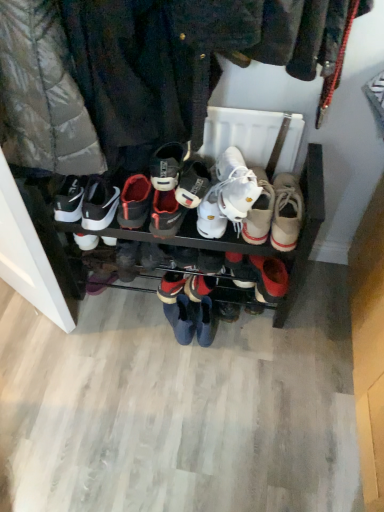
Question: Is white leather sneakers at center, which is counted as the sixth footwear, starting from the left, touching blue suede boots at center, the fourth footwear viewed from the left?

Choices:
 (A) yes
 (B) no

Answer: (B)

Question: Can blue suede boots at center, marked as the 5th footwear in a right-to-left arrangement, be found inside white leather sneakers at center, which is counted as the sixth footwear, starting from the left?

Choices:
 (A) yes
 (B) no

Answer: (B)

Question: From the image's perspective, is white leather sneakers at center, which is counted as the sixth footwear, starting from the left, above blue suede boots at center, the fourth footwear viewed from the left?

Choices:
 (A) yes
 (B) no

Answer: (A)

Question: Is white leather sneakers at center, which is counted as the sixth footwear, starting from the left, thinner than blue suede boots at center, the fourth footwear viewed from the left?

Choices:
 (A) yes
 (B) no

Answer: (B)

Question: Is white leather sneakers at center, which is counted as the sixth footwear, starting from the left, positioned with its back to blue suede boots at center, marked as the 5th footwear in a right-to-left arrangement?

Choices:
 (A) no
 (B) yes

Answer: (A)

Question: Is white leather sneaker at center, which is the second footwear from left to right, bigger or smaller than white leather sneakers at center, positioned as the 5th footwear in left-to-right order?

Choices:
 (A) big
 (B) small

Answer: (B)

Question: Considering the positions of white leather sneaker at center, which is the second footwear from left to right, and white leather sneakers at center, which is the 4th footwear from right to left, in the image, is white leather sneaker at center, which is the second footwear from left to right, wider or thinner than white leather sneakers at center, which is the 4th footwear from right to left,?

Choices:
 (A) thin
 (B) wide

Answer: (A)

Question: From a real-world perspective, is white leather sneaker at center, which is counted as the 7th footwear, starting from the right, above or below white leather sneakers at center, which is the 4th footwear from right to left?

Choices:
 (A) below
 (B) above

Answer: (B)

Question: In terms of height, does white leather sneaker at center, which is counted as the 7th footwear, starting from the right, look taller or shorter compared to white leather sneakers at center, which is the 4th footwear from right to left?

Choices:
 (A) short
 (B) tall

Answer: (A)

Question: Considering the positions of point (157, 209) and point (259, 291), is point (157, 209) closer or farther from the camera than point (259, 291)?

Choices:
 (A) farther
 (B) closer

Answer: (B)

Question: Would you say white synthetic shoe at center, arranged as the sixth footwear when viewed from the right, is to the left or to the right of white leather sneakers at center, positioned as the 5th footwear in left-to-right order, in the picture?

Choices:
 (A) left
 (B) right

Answer: (A)

Question: In terms of height, does white synthetic shoe at center, the 3th footwear positioned from the left, look taller or shorter compared to white leather sneakers at center, positioned as the 5th footwear in left-to-right order?

Choices:
 (A) short
 (B) tall

Answer: (A)

Question: Is white synthetic shoe at center, arranged as the sixth footwear when viewed from the right, wider or thinner than white leather sneakers at center, which is the 4th footwear from right to left?

Choices:
 (A) thin
 (B) wide

Answer: (A)

Question: Is point (208, 233) positioned closer to the camera than point (137, 225)?

Choices:
 (A) closer
 (B) farther

Answer: (A)

Question: Relative to black leather sneaker at center, the eighth footwear in the right-to-left sequence, is white leather sneakers at center, acting as the third footwear starting from the right, in front or behind?

Choices:
 (A) front
 (B) behind

Answer: (A)